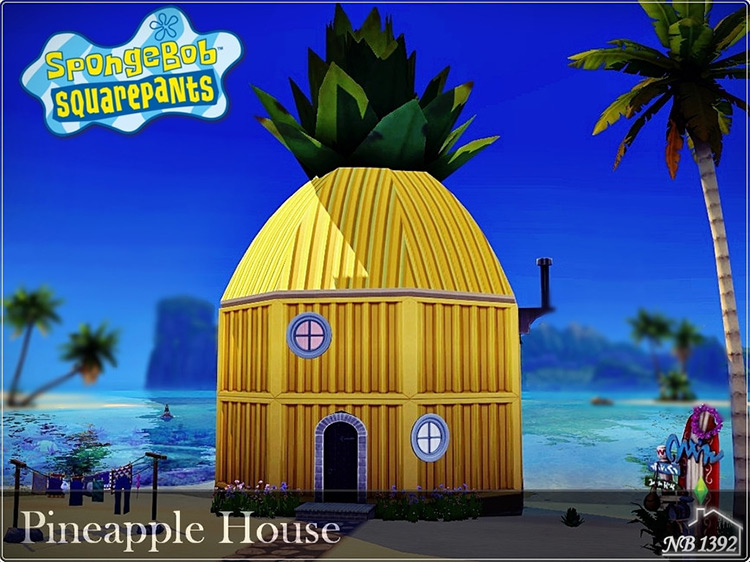
Where is `round window`? The image size is (750, 562). round window is located at coordinates (310, 328), (429, 438).